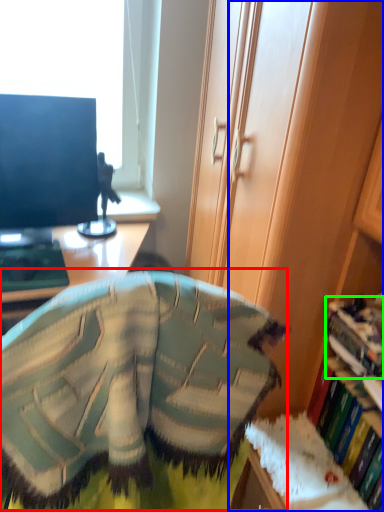
Question: Which object is the closest to the bean bag chair (highlighted by a red box)? Choose among these: cabinetry (highlighted by a blue box) or book (highlighted by a green box).

Choices:
 (A) cabinetry
 (B) book

Answer: (A)